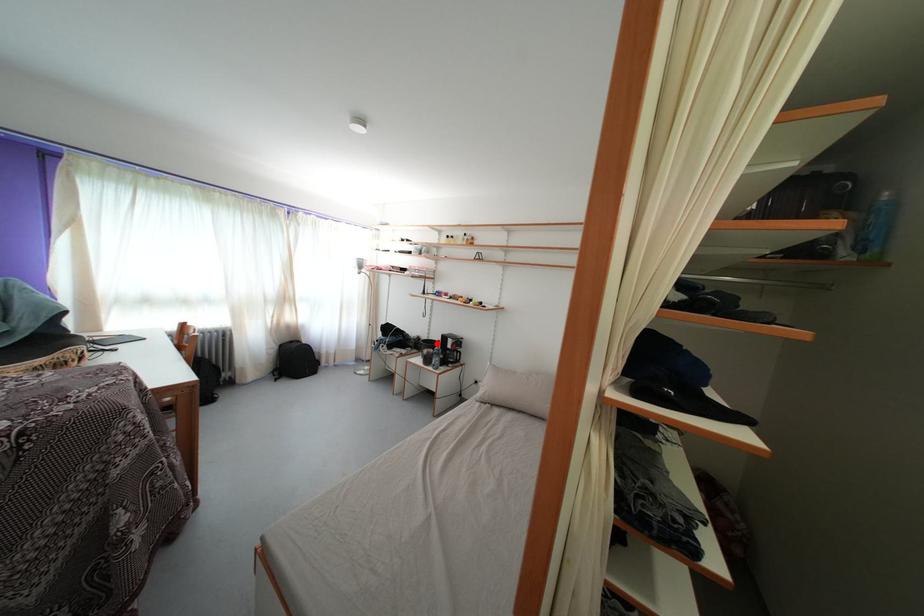
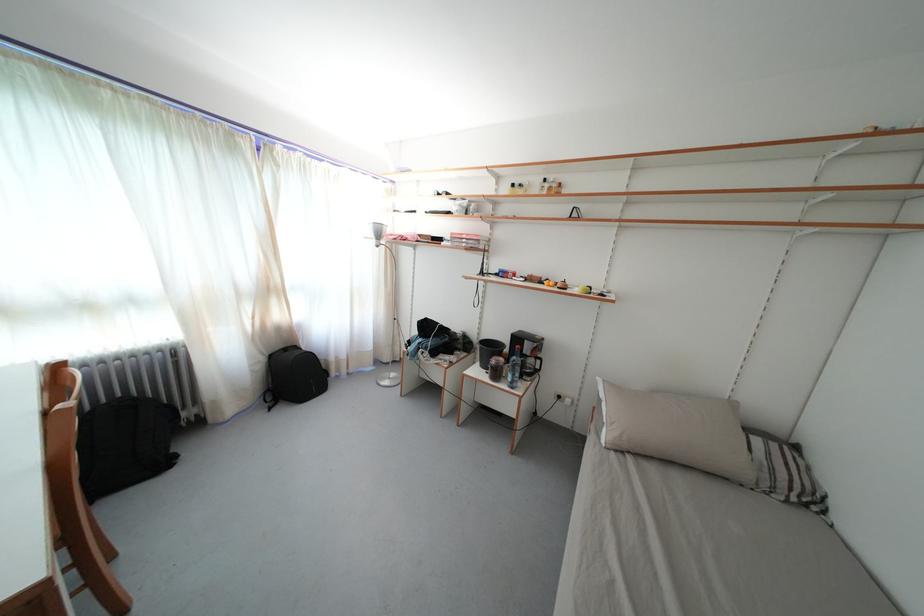
Question: I am providing you with two images of the same scene from different viewpoints. A red point is shown in image1. For the corresponding object point in image2, is it positioned nearer or farther from the camera?

Choices:
 (A) Nearer
 (B) Farther

Answer: (A)